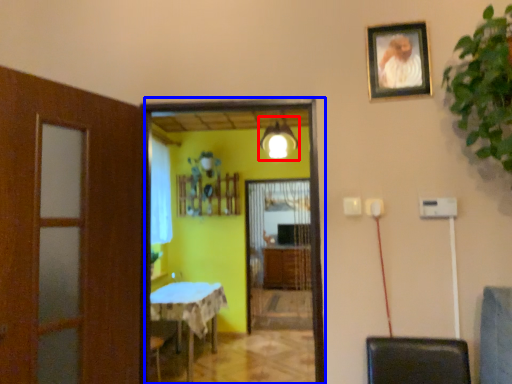
Question: Which of the following is the farthest to the observer, light fixture (highlighted by a red box) or screen door (highlighted by a blue box)?

Choices:
 (A) light fixture
 (B) screen door

Answer: (A)